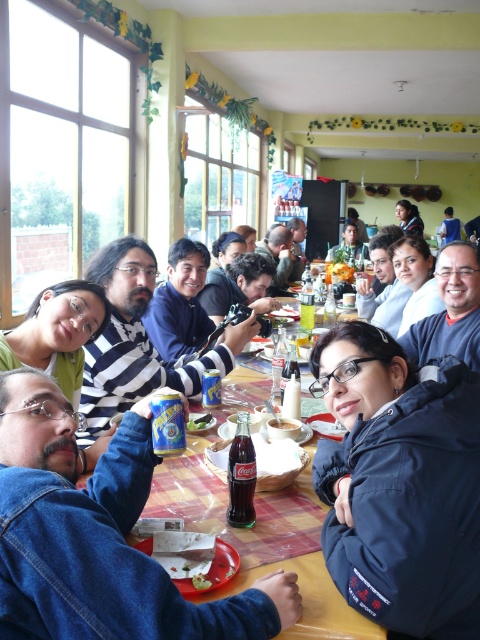
Question: Can you confirm if plaid fabric table at center is wider than blue denim jacket at upper right?

Choices:
 (A) yes
 (B) no

Answer: (A)

Question: Is denim jacket at lower left below green leafy vegetable at table center?

Choices:
 (A) yes
 (B) no

Answer: (A)

Question: Which point appears farthest from the camera in this image?

Choices:
 (A) click(133, 316)
 (B) click(448, 593)
 (C) click(295, 422)
 (D) click(197, 419)

Answer: (A)

Question: Which of the following is the closest to the observer?

Choices:
 (A) (287, 422)
 (B) (448, 230)
 (C) (199, 284)
 (D) (194, 417)

Answer: (A)

Question: Does denim jacket at lower left appear on the left side of green leafy vegetable at table center?

Choices:
 (A) no
 (B) yes

Answer: (B)

Question: Which of these objects is positioned farthest from the dark blue jacket at lower right?

Choices:
 (A) green leafy vegetable at table center
 (B) white matte bowl at center

Answer: (A)